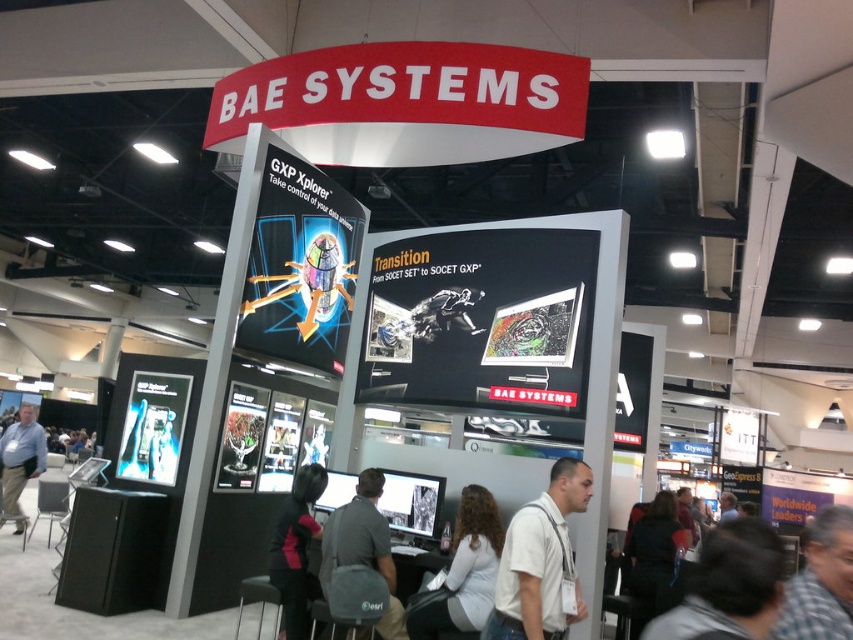
Question: Which of the following is the closest to the observer?

Choices:
 (A) light brown leather jacket at center
 (B) dark gray jacket at lower right
 (C) white cotton shirt at center
 (D) gray fabric backpack at center

Answer: (C)

Question: Is gray fabric shirt at lower right bigger than dark gray jacket at lower right?

Choices:
 (A) yes
 (B) no

Answer: (B)

Question: Is the position of light gray sweater at center less distant than that of dark gray jacket at lower right?

Choices:
 (A) yes
 (B) no

Answer: (A)

Question: Among these objects, which one is nearest to the camera?

Choices:
 (A) dark gray jacket at lower right
 (B) skinny jeans at lower left

Answer: (A)

Question: Does white cotton shirt at center have a lesser width compared to light brown leather jacket at center?

Choices:
 (A) yes
 (B) no

Answer: (B)

Question: Which of these objects is positioned farthest from the gray fabric shirt at lower right?

Choices:
 (A) light gray sweater at center
 (B) gray fabric backpack at center

Answer: (B)